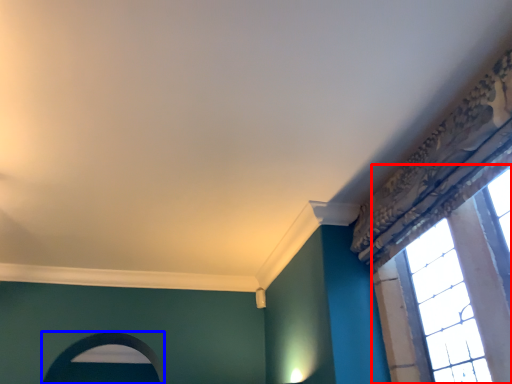
Question: Which object is further to the camera taking this photo, window (highlighted by a red box) or archway (highlighted by a blue box)?

Choices:
 (A) window
 (B) archway

Answer: (B)